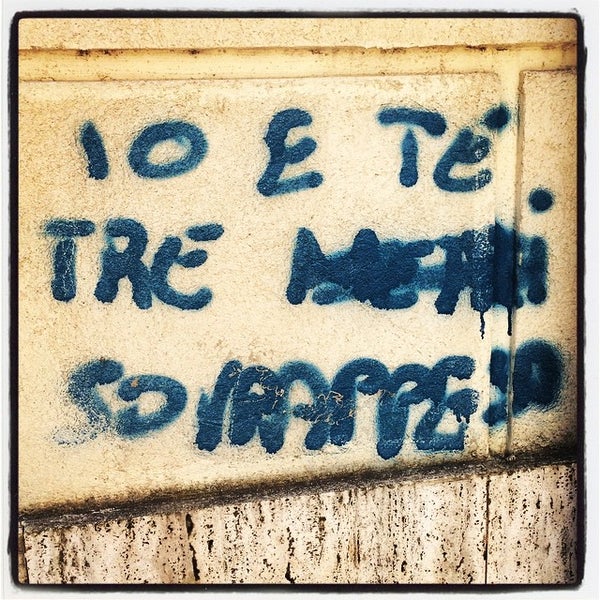
This screenshot has height=600, width=600. I want to click on light beige paint on a piece of board, so click(x=362, y=180).